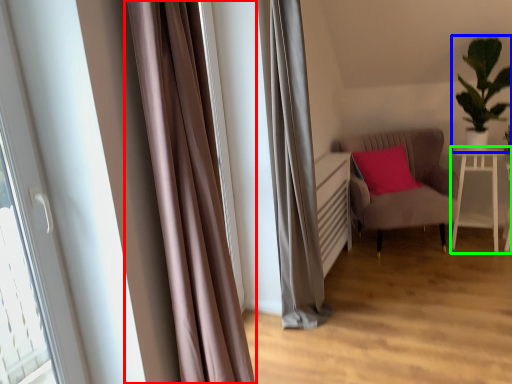
Question: Estimate the real-world distances between objects in this image. Which object is farther from curtain (highlighted by a red box), houseplant (highlighted by a blue box) or table (highlighted by a green box)?

Choices:
 (A) houseplant
 (B) table

Answer: (B)